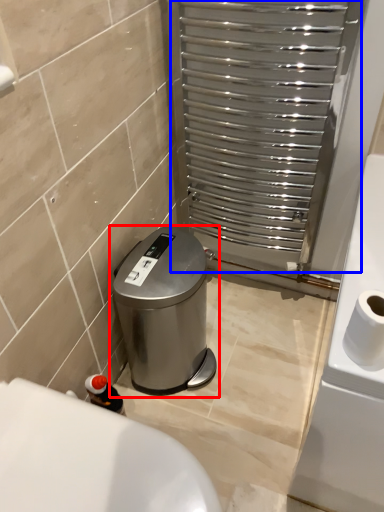
Question: Which of the following is the closest to the observer, waste container (highlighted by a red box) or screen door (highlighted by a blue box)?

Choices:
 (A) waste container
 (B) screen door

Answer: (B)